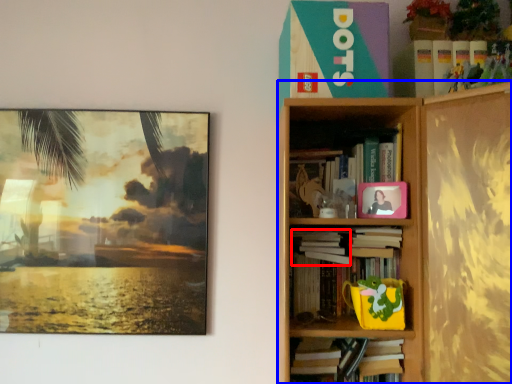
Question: Which point is further to the camera, book (highlighted by a red box) or bookcase (highlighted by a blue box)?

Choices:
 (A) book
 (B) bookcase

Answer: (A)